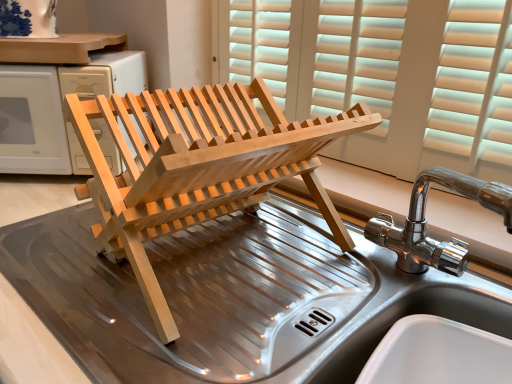
Question: Considering their positions, is chrome metallic tap at right located in front of or behind natural wood dish rack at center?

Choices:
 (A) behind
 (B) front

Answer: (B)

Question: Do you think chrome metallic tap at right is within natural wood dish rack at center, or outside of it?

Choices:
 (A) outside
 (B) inside

Answer: (A)

Question: Estimate the real-world distances between objects in this image. Which object is closer to the chrome metallic tap at right?

Choices:
 (A) natural wood dish rack at center
 (B) stainless steel sink at center
 (C) natural wood dish rack at center
 (D) natural wood dish rack at center

Answer: (B)

Question: Based on their relative distances, which object is nearer to the stainless steel sink at center?

Choices:
 (A) chrome metallic tap at right
 (B) natural wood dish rack at center
 (C) natural wood dish rack at center
 (D) natural wood dish rack at center

Answer: (A)